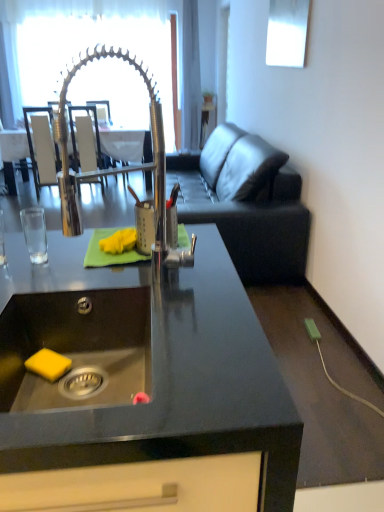
Locate an element on the screen. This screenshot has width=384, height=512. free point behind polished chrome tap at center is located at coordinates (133, 266).